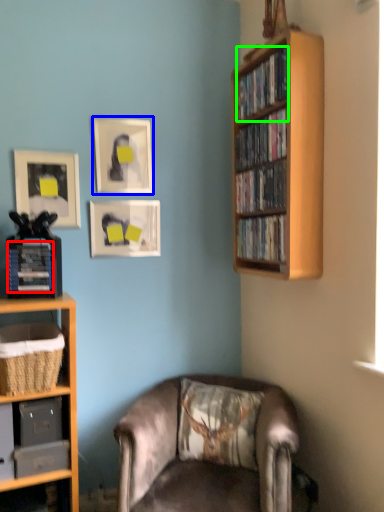
Question: Based on their relative distances, which object is nearer to paperback book (highlighted by a red box)? Choose from picture frame (highlighted by a blue box) and book (highlighted by a green box).

Choices:
 (A) picture frame
 (B) book

Answer: (A)